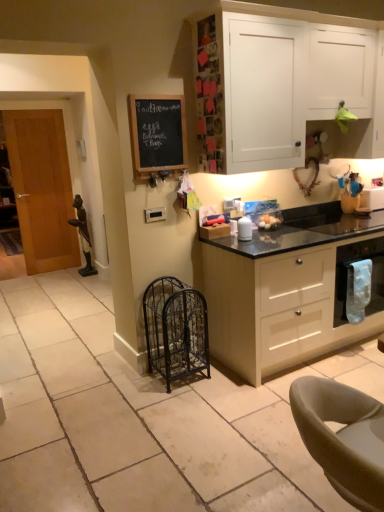
Question: Can leather-like gray chair at lower right be found inside blue fabric towel at right?

Choices:
 (A) yes
 (B) no

Answer: (B)

Question: From the image's perspective, is blue fabric towel at right below leather-like gray chair at lower right?

Choices:
 (A) no
 (B) yes

Answer: (A)

Question: Can you confirm if blue fabric towel at right is wider than leather-like gray chair at lower right?

Choices:
 (A) yes
 (B) no

Answer: (B)

Question: From the image's perspective, does blue fabric towel at right appear higher than leather-like gray chair at lower right?

Choices:
 (A) no
 (B) yes

Answer: (B)

Question: Is blue fabric towel at right in front of leather-like gray chair at lower right?

Choices:
 (A) yes
 (B) no

Answer: (B)

Question: Considering their positions, is black wrought iron cage at lower center located in front of or behind blue fabric towel at right?

Choices:
 (A) front
 (B) behind

Answer: (A)

Question: Considering the positions of point 165,362 and point 357,271, is point 165,362 closer or farther from the camera than point 357,271?

Choices:
 (A) farther
 (B) closer

Answer: (B)

Question: Would you say black wrought iron cage at lower center is to the left or to the right of blue fabric towel at right in the picture?

Choices:
 (A) right
 (B) left

Answer: (B)

Question: From the image's perspective, is black wrought iron cage at lower center above or below blue fabric towel at right?

Choices:
 (A) above
 (B) below

Answer: (B)

Question: Does point (369, 286) appear closer or farther from the camera than point (175, 142)?

Choices:
 (A) farther
 (B) closer

Answer: (A)

Question: Is blue fabric towel at right taller or shorter than black chalkboard at upper left?

Choices:
 (A) tall
 (B) short

Answer: (B)

Question: In terms of size, does blue fabric towel at right appear bigger or smaller than black chalkboard at upper left?

Choices:
 (A) small
 (B) big

Answer: (A)

Question: Is blue fabric towel at right spatially inside black chalkboard at upper left, or outside of it?

Choices:
 (A) outside
 (B) inside

Answer: (A)

Question: In terms of size, does wooden door at left appear bigger or smaller than black granite countertop at center?

Choices:
 (A) big
 (B) small

Answer: (B)

Question: Do you think wooden door at left is within black granite countertop at center, or outside of it?

Choices:
 (A) outside
 (B) inside

Answer: (A)